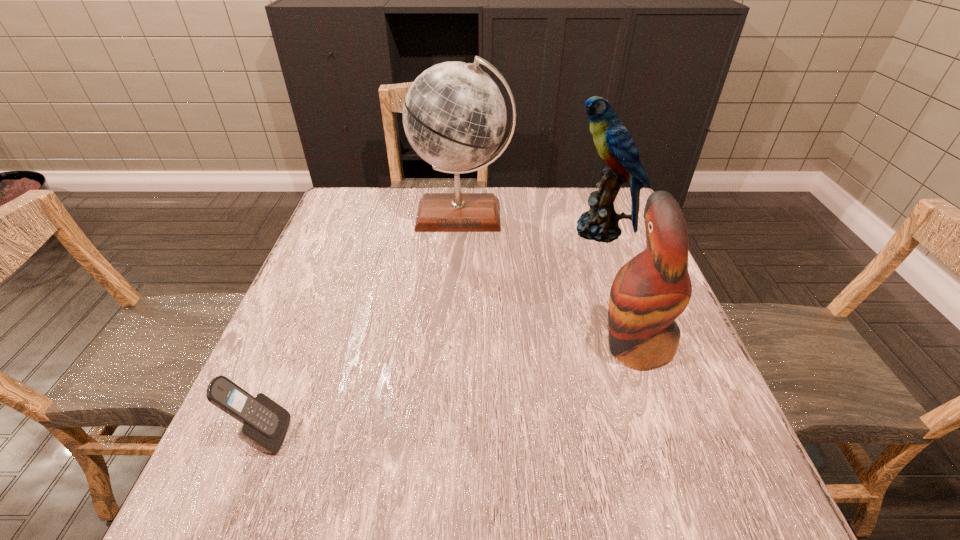
The width and height of the screenshot is (960, 540). Find the location of `free space at the left edge of the desktop`. free space at the left edge of the desktop is located at coordinates (335, 232).

Locate an element on the screen. vacant area at the right edge of the desktop is located at coordinates (700, 451).

The height and width of the screenshot is (540, 960). In the image, there is a desktop. Find the location of `vacant space at the far left corner`. vacant space at the far left corner is located at coordinates (372, 187).

Where is `free region at the near left corner`? free region at the near left corner is located at coordinates (204, 486).

I want to click on free space between the globe and the third farthest object, so click(x=549, y=280).

At what (x,y) coordinates should I click in order to perform the action: click on free area in between the nearer parrot and the nearest object. Please return your answer as a coordinate pair (x, y). This screenshot has width=960, height=540. Looking at the image, I should click on (449, 390).

Identify the location of vacant space in between the leftmost object and the farther parrot. The width and height of the screenshot is (960, 540). (431, 333).

The image size is (960, 540). In order to click on free space between the globe and the second nearest object in this screenshot , I will do `click(549, 280)`.

Locate an element on the screen. The height and width of the screenshot is (540, 960). vacant region between the third object from right to left and the farther parrot is located at coordinates (531, 223).

Where is `empty location between the shortest object and the farther parrot`? Image resolution: width=960 pixels, height=540 pixels. empty location between the shortest object and the farther parrot is located at coordinates (431, 333).